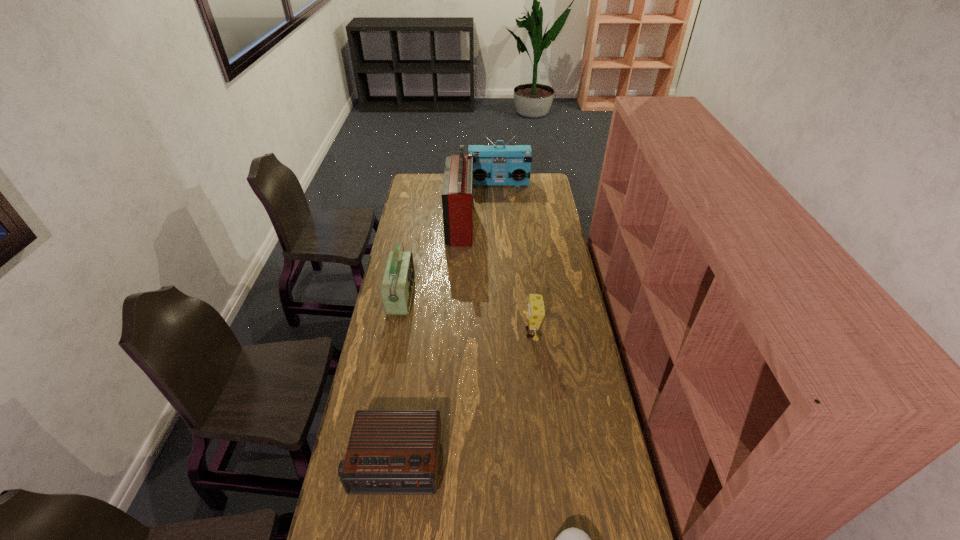
Find the location of a particular element. Image resolution: width=960 pixels, height=540 pixels. the second farthest radio receiver is located at coordinates (457, 191).

At what (x,y) coordinates should I click in order to perform the action: click on the farthest object. Please return your answer as a coordinate pair (x, y). Looking at the image, I should click on (x=492, y=165).

This screenshot has height=540, width=960. Identify the location of the farthest radio receiver. (492, 165).

I want to click on the second nearest radio receiver, so click(x=397, y=284).

At what (x,y) coordinates should I click in order to perform the action: click on the second shortest radio receiver. Please return your answer as a coordinate pair (x, y). Looking at the image, I should click on (397, 284).

Find the location of a particular element. sponge is located at coordinates (536, 310).

Identify the location of the second shortest object. (390, 451).

What are the coordinates of `the shortest radio receiver` in the screenshot? It's located at (390, 451).

The image size is (960, 540). I want to click on free space located 0.380m on the front-facing side of the second farthest radio receiver, so click(544, 223).

The width and height of the screenshot is (960, 540). Identify the location of free spot located 0.080m on the front-facing side of the fifth shortest object. (499, 195).